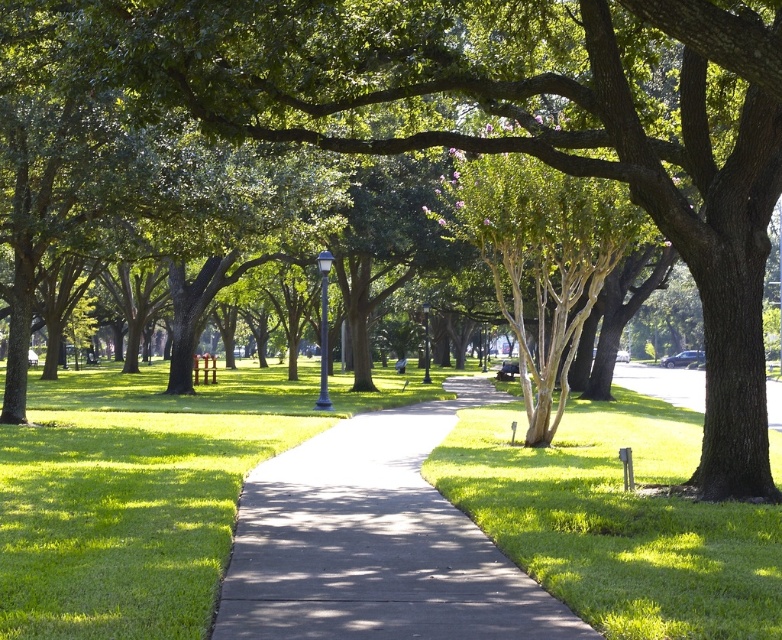
You are a gardener who needs to mow the lawn. You see the green grass at center and the dark gray concrete sidewalk at center. Which one should you mow?

Answer: You should mow the green grass at center because it is the grassy area, while the dark gray concrete sidewalk at center is a paved path and does not require mowing.

You are standing at the point marked as point (615, 518) in the park scene. What surface are you currently standing on?

The point (615, 518) is on green grass at center, so you are standing on the green grass at center.